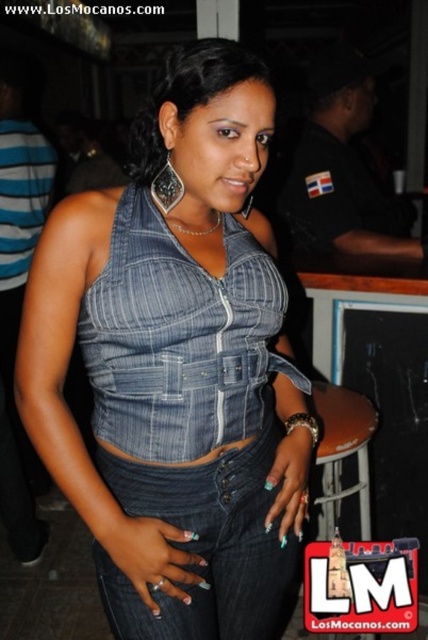
You are a photographer at an event and want to take a photo of the black uniform at upper center and the denim top at center. Which object is closer to the camera?

The black uniform at upper center is closer to the camera because it is further to the viewer than the denim top at center.

You are taking a photo at a social event and want to focus on both the point at location [256,371] and the point at [190,61]. Which point is closer to your camera lens?

Point [256,371] is further to the camera than point [190,61], so the point at [190,61] is closer to the camera lens.